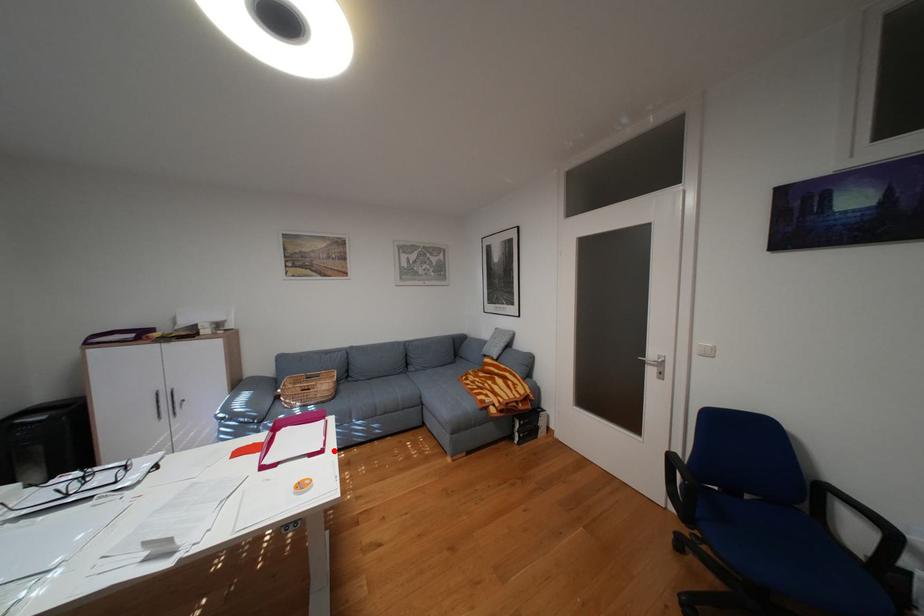
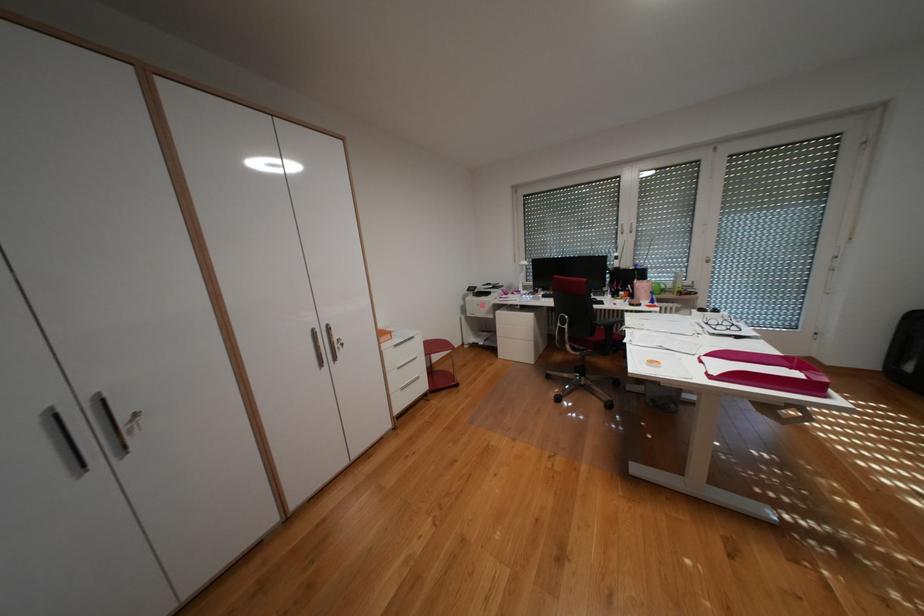
Question: I am providing you with two images of the same scene from different viewpoints. In image1, a red point is highlighted. Considering the same 3D point in image2, which of the following is correct?

Choices:
 (A) It is closer
 (B) It is farther

Answer: (B)